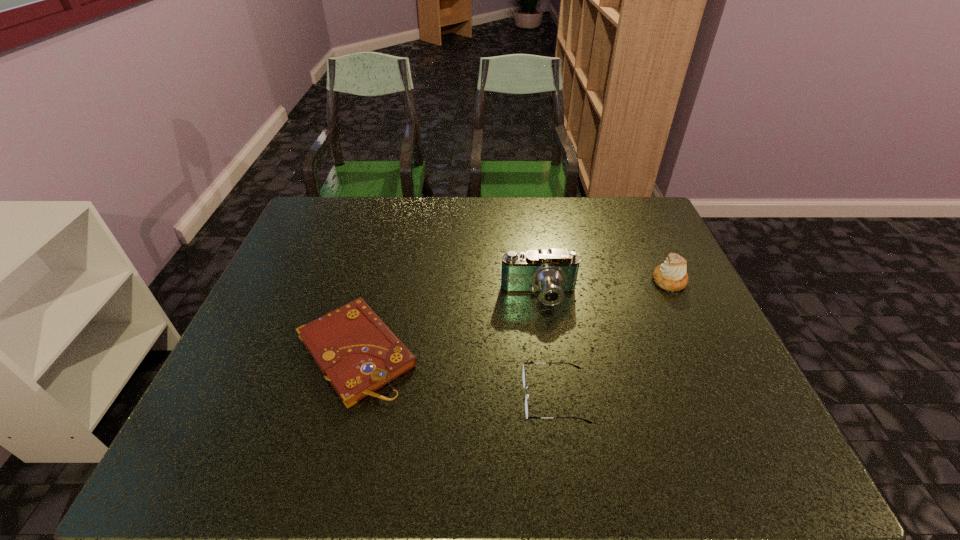
This screenshot has width=960, height=540. What are the coordinates of `camcorder` in the screenshot? It's located at (551, 273).

You are a GUI agent. You are given a task and a screenshot of the screen. Output one action in this format:
    pyautogui.click(x=<x>, y=<y>)
    Task: Click on the pastry
    
    Given the screenshot: What is the action you would take?
    pyautogui.click(x=671, y=276)

Where is `the rightmost object`? the rightmost object is located at coordinates (671, 276).

Where is `spectacles`? This screenshot has width=960, height=540. spectacles is located at coordinates (524, 377).

Locate an element on the screen. This screenshot has height=540, width=960. the leftmost object is located at coordinates click(354, 349).

Where is `free space located 0.380m on the front-facing side of the camcorder`? Image resolution: width=960 pixels, height=540 pixels. free space located 0.380m on the front-facing side of the camcorder is located at coordinates (561, 451).

Locate an element on the screen. The height and width of the screenshot is (540, 960). vacant position located 0.240m on the left of the rightmost object is located at coordinates (568, 281).

Find the location of a particular element. vacant area situated 0.280m on the lenses of the spectacles is located at coordinates tap(396, 397).

Where is `vacant area located on the lenses of the spectacles`? vacant area located on the lenses of the spectacles is located at coordinates (x=455, y=397).

I want to click on free space located 0.210m on the lenses of the spectacles, so click(428, 397).